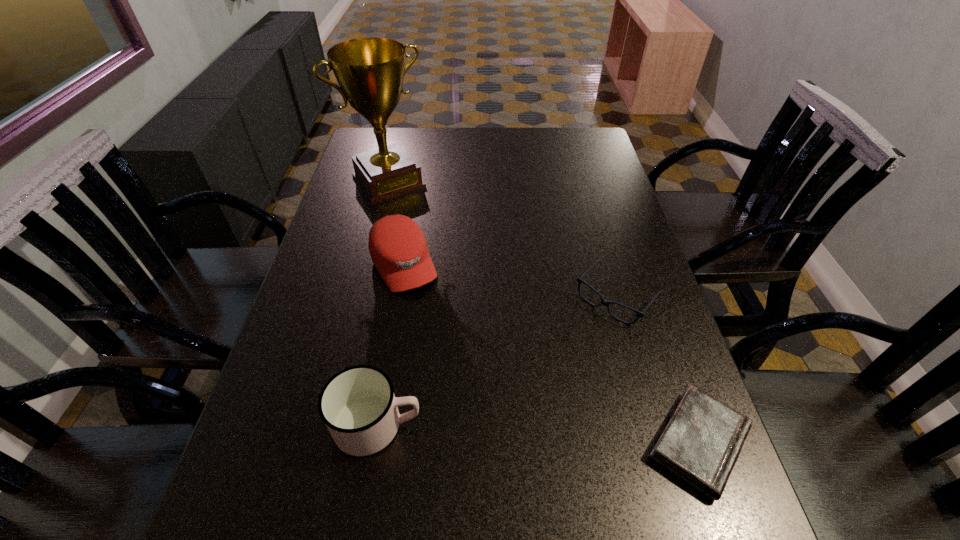
Locate an element on the screen. vacant space at the left edge of the desktop is located at coordinates (340, 264).

Where is `free space at the right edge of the desktop`? free space at the right edge of the desktop is located at coordinates (635, 288).

In the image, there is a desktop. At what (x,y) coordinates should I click in order to perform the action: click on vacant area at the far right corner. Please return your answer as a coordinate pair (x, y). Looking at the image, I should click on (564, 138).

Locate an element on the screen. This screenshot has height=540, width=960. vacant space at the near right corner of the desktop is located at coordinates (638, 485).

The height and width of the screenshot is (540, 960). What are the coordinates of `unoccupied area between the mug and the diary` in the screenshot? It's located at (539, 434).

Where is `free space between the farthest object and the mug`? The width and height of the screenshot is (960, 540). free space between the farthest object and the mug is located at coordinates (383, 303).

The height and width of the screenshot is (540, 960). I want to click on vacant space that's between the cap and the spectacles, so click(x=510, y=280).

You are a GUI agent. You are given a task and a screenshot of the screen. Output one action in this format:
    pyautogui.click(x=<x>, y=<y>)
    Task: Click on the vacant space that's between the diary and the cap
    Image resolution: width=960 pixels, height=540 pixels.
    Given the screenshot: What is the action you would take?
    pyautogui.click(x=551, y=354)

The height and width of the screenshot is (540, 960). I want to click on unoccupied position between the second shortest object and the mug, so click(497, 361).

This screenshot has width=960, height=540. I want to click on unoccupied area between the diary and the cap, so click(x=551, y=354).